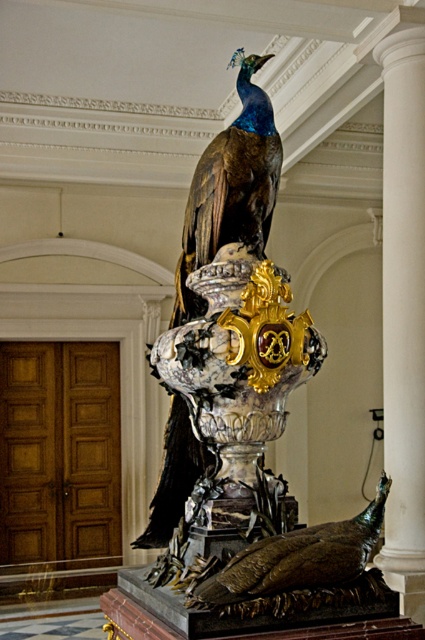
You are an art conservator examining the sculpture from the front. You notice two points marked on the sculpture. The first point is at coordinate point [354,561] and the second is at point [203,211]. Which point is nearer to your current position?

Point [354,561] is closer to the viewer than point [203,211], so the first point is nearer to your current position.

You are an art curator standing in front of the sculpture. You notice a specific point at coordinates [243,420]. What object is located at this point?

The point at coordinates [243,420] indicates the shiny bronze peacock at upper center.